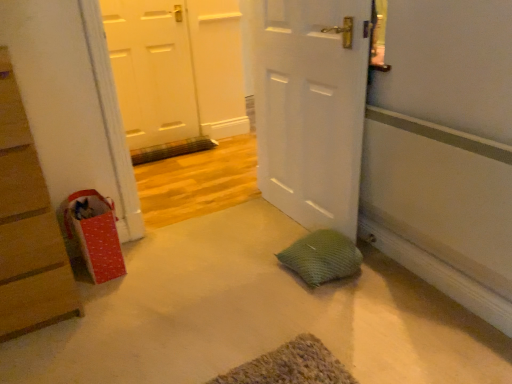
Where is `blank area to the left of green mesh pillow at center`? The image size is (512, 384). blank area to the left of green mesh pillow at center is located at coordinates (257, 273).